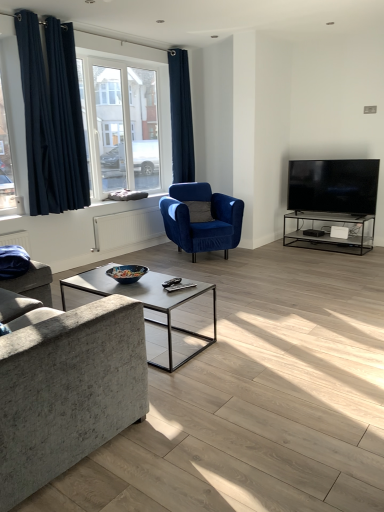
The height and width of the screenshot is (512, 384). Find the location of `vacant area that is in front of velvet blue armchair at center`. vacant area that is in front of velvet blue armchair at center is located at coordinates (214, 267).